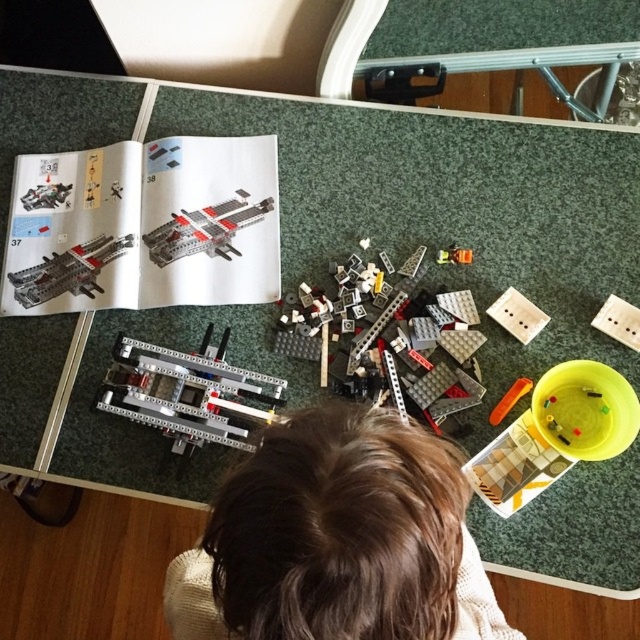
In the scene shown: Who is positioned more to the right, translucent plastic spaceship at upper center or matte black plastic space shuttle at upper left?

Positioned to the right is translucent plastic spaceship at upper center.

Between point (248, 198) and point (24, 280), which one is positioned behind?

Point (248, 198)

Is point (150, 248) behind point (60, 260)?

No, it is not.

Image resolution: width=640 pixels, height=640 pixels. In order to click on translucent plastic spaceship at upper center in this screenshot , I will do `click(204, 228)`.

Who is taller, translucent yellow bowl at lower right or translucent plastic spaceship at upper center?

translucent yellow bowl at lower right

Is point (572, 419) positioned after point (170, 243)?

No.

Is point (492, 496) farther from viewer compared to point (208, 218)?

That is False.

In order to click on translucent yellow bowl at lower right in this screenshot , I will do `click(556, 433)`.

The image size is (640, 640). I want to click on translucent plastic spaceship at upper center, so click(204, 228).

Does translucent plastic spaceship at upper center come in front of metallic orange and yellow at center?

No, translucent plastic spaceship at upper center is behind metallic orange and yellow at center.

Between point (195, 225) and point (452, 260), which one is positioned behind?

Point (195, 225)

Where is `translucent plastic spaceship at upper center`? translucent plastic spaceship at upper center is located at coordinates (204, 228).